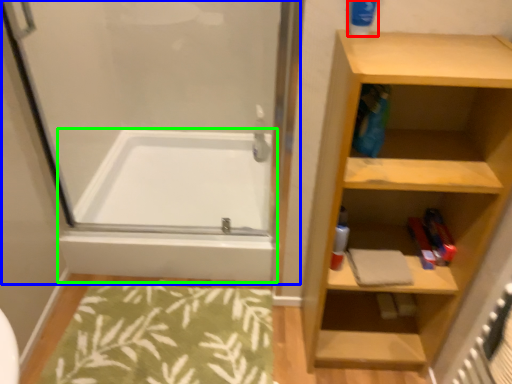
Question: Estimate the real-world distances between objects in this image. Which object is closer to cleaning product (highlighted by a red box), screen door (highlighted by a blue box) or bathtub (highlighted by a green box)?

Choices:
 (A) screen door
 (B) bathtub

Answer: (A)